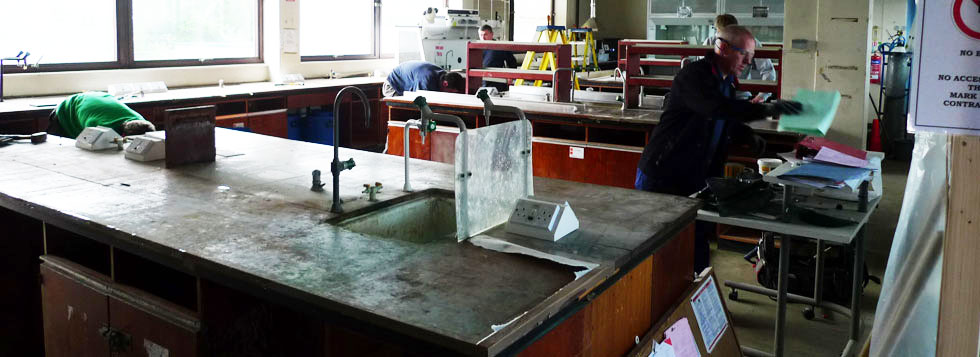
The image size is (980, 357). I want to click on ladders, so click(555, 33), click(584, 43).